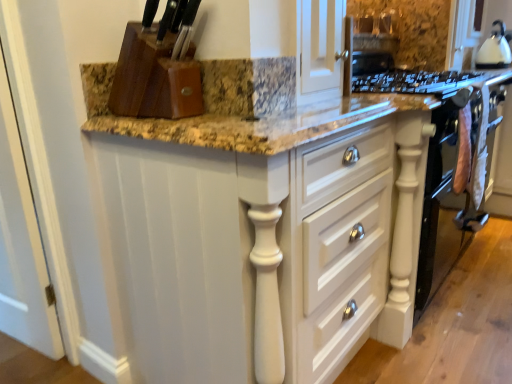
Question: Would you say white glossy kettle at upper right is inside or outside white painted wood cabinet at center?

Choices:
 (A) inside
 (B) outside

Answer: (B)

Question: Is white glossy kettle at upper right to the left or to the right of white painted wood cabinet at center in the image?

Choices:
 (A) left
 (B) right

Answer: (B)

Question: Is white glossy kettle at upper right wider or thinner than white painted wood cabinet at center?

Choices:
 (A) thin
 (B) wide

Answer: (A)

Question: Considering the positions of point click(x=283, y=296) and point click(x=500, y=21), is point click(x=283, y=296) closer or farther from the camera than point click(x=500, y=21)?

Choices:
 (A) closer
 (B) farther

Answer: (A)

Question: Based on their sizes in the image, would you say white painted wood cabinet at center is bigger or smaller than white glossy kettle at upper right?

Choices:
 (A) small
 (B) big

Answer: (B)

Question: Choose the correct answer: Is white painted wood cabinet at center inside white glossy kettle at upper right or outside it?

Choices:
 (A) outside
 (B) inside

Answer: (A)

Question: Considering the positions of white painted wood cabinet at center and white glossy kettle at upper right in the image, is white painted wood cabinet at center taller or shorter than white glossy kettle at upper right?

Choices:
 (A) short
 (B) tall

Answer: (B)